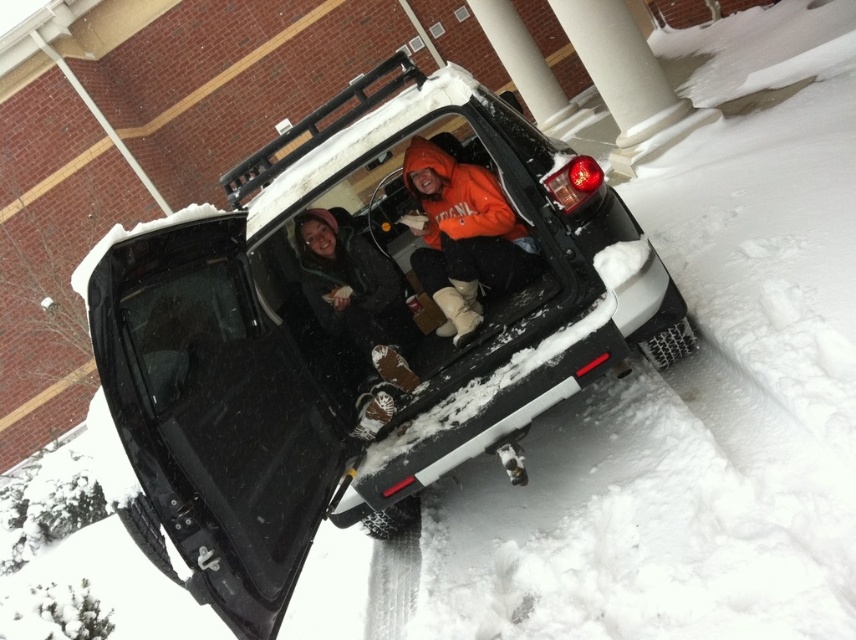
Is black matte truck at center closer to camera compared to orange fleece jacket at center?

Yes, it is in front of orange fleece jacket at center.

Between black matte truck at center and orange fleece jacket at center, which one is positioned lower?

black matte truck at center is lower down.

Is point (169, 401) in front of point (432, 161)?

Yes, point (169, 401) is closer to viewer.

Locate an element on the screen. black matte truck at center is located at coordinates (348, 337).

Can you confirm if orange fleece jacket at center is smaller than matte black jacket at center?

Correct, orange fleece jacket at center occupies less space than matte black jacket at center.

Who is higher up, orange fleece jacket at center or matte black jacket at center?

Positioned higher is orange fleece jacket at center.

Is point (479, 212) closer to camera compared to point (405, 371)?

No, (479, 212) is behind (405, 371).

This screenshot has height=640, width=856. I want to click on orange fleece jacket at center, so [x=464, y=236].

Who is lower down, black matte truck at center or matte black jacket at center?

black matte truck at center

How far apart are black matte truck at center and matte black jacket at center?

The distance of black matte truck at center from matte black jacket at center is 15.73 inches.

Locate an element on the screen. black matte truck at center is located at coordinates (348, 337).

This screenshot has height=640, width=856. Identify the location of black matte truck at center. (348, 337).